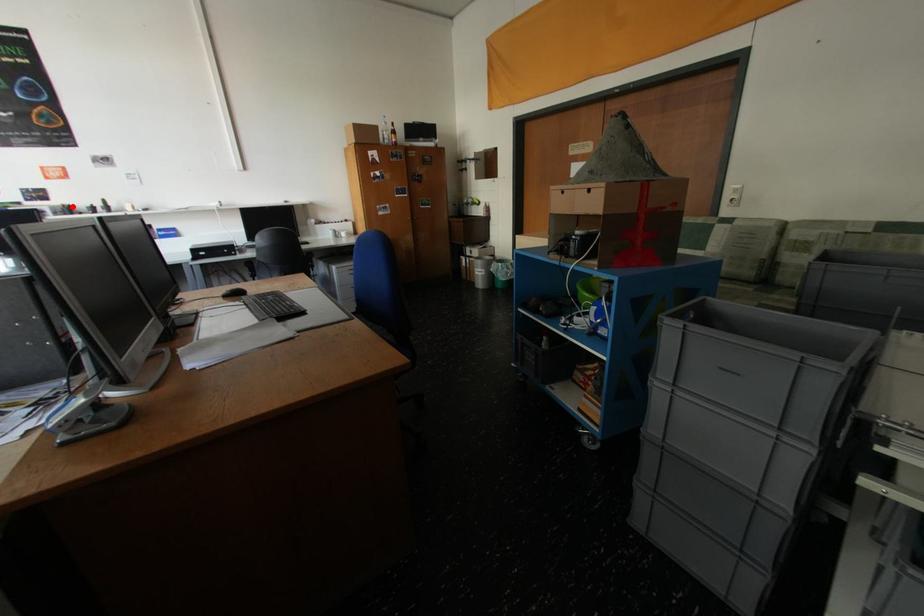
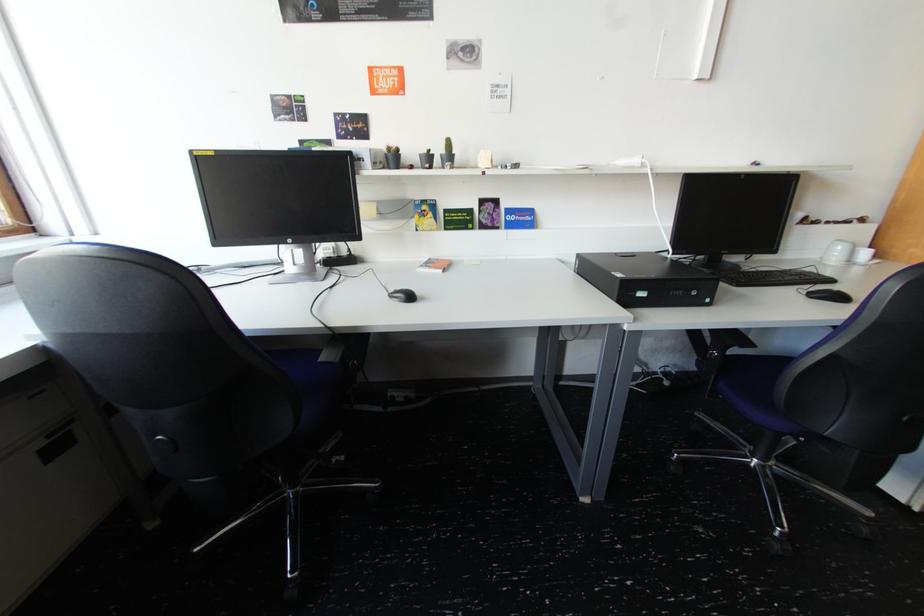
The point at the highlighted location is marked in the first image. Where is the corresponding point in the second image?

(397, 150)